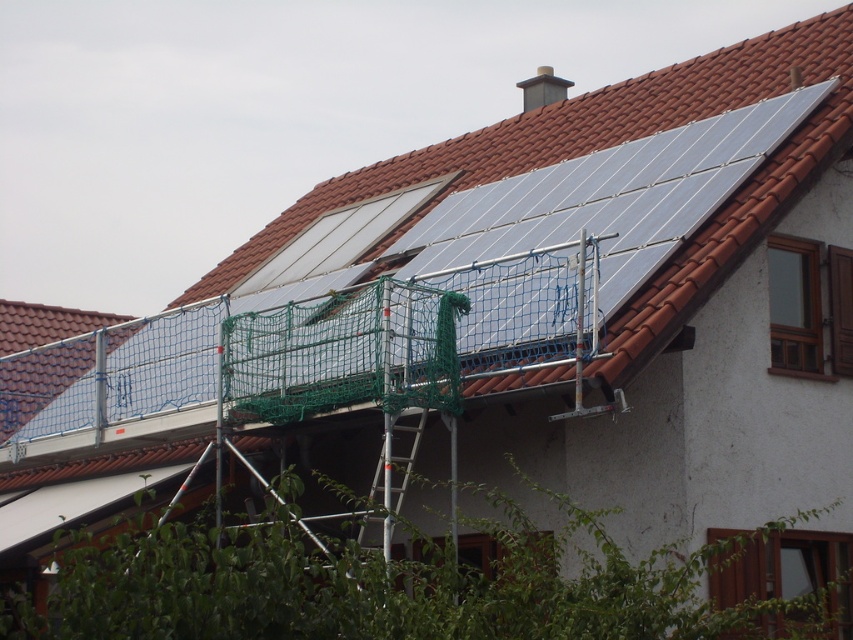
You are a worker standing at the edge of the roof and need to move to a specific location. You see two points marked on the roof, point A at point [192,314] and point B at point [387,433]. If you are facing the building, which point should you walk towards first to reach the point behind the other?

You should walk towards point B at [387,433] first because point A at [192,314] is behind it. Since you need to reach the point behind the other, you must first go to the front point, which is point B, and then proceed to the one behind it, which is point A.

You are a worker on the roof and need to climb down from the metallic solar panels at upper center to the ground. You see the silver metallic ladder at center. Can you safely reach the ladder from the panels without stepping on the safety net?

The metallic solar panels at upper center are closer to the viewer than the silver metallic ladder at center, so the ladder is further away. You would need to move towards the ladder from the panels, but since the safety net is draped over part of the scaffolding, you might have to step around or over it, which may not be safe. Therefore, it is not advisable to attempt reaching the ladder directly from the panels without considering the safety net obstruction.

You are a technician standing on the roof and need to access the metallic solar panels at upper center. You see the silver metallic ladder at center. Which direction should you move relative to the ladder to reach the solar panels?

The metallic solar panels at upper center are to the right of the silver metallic ladder at center. So you should move to the right of the silver metallic ladder at center to reach them.